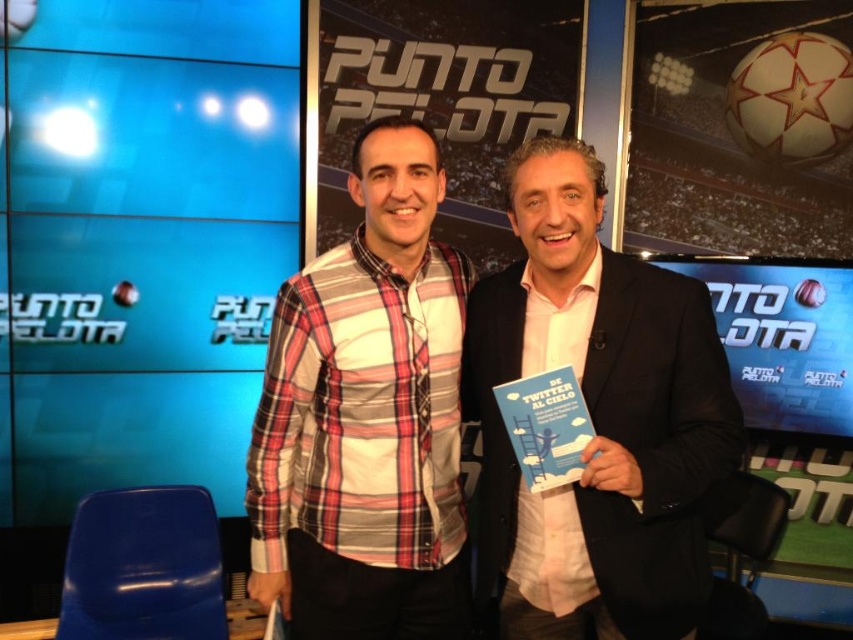
Question: Where is matte black suit at center located in relation to plaid cotton shirt at center in the image?

Choices:
 (A) above
 (B) below

Answer: (B)

Question: Which point appears farthest from the camera in this image?

Choices:
 (A) (323, 518)
 (B) (595, 438)

Answer: (A)

Question: Does matte black suit at center appear over plaid cotton shirt at center?

Choices:
 (A) yes
 (B) no

Answer: (B)

Question: Can you confirm if matte black suit at center is positioned above plaid cotton shirt at center?

Choices:
 (A) no
 (B) yes

Answer: (A)

Question: Which object is farther from the camera taking this photo?

Choices:
 (A) matte black suit at center
 (B) plaid cotton shirt at center

Answer: (B)